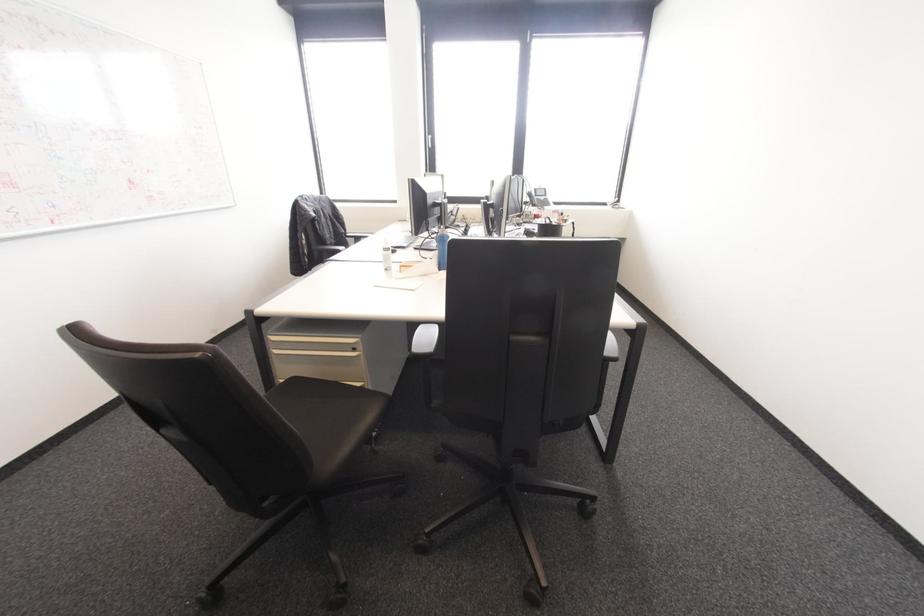
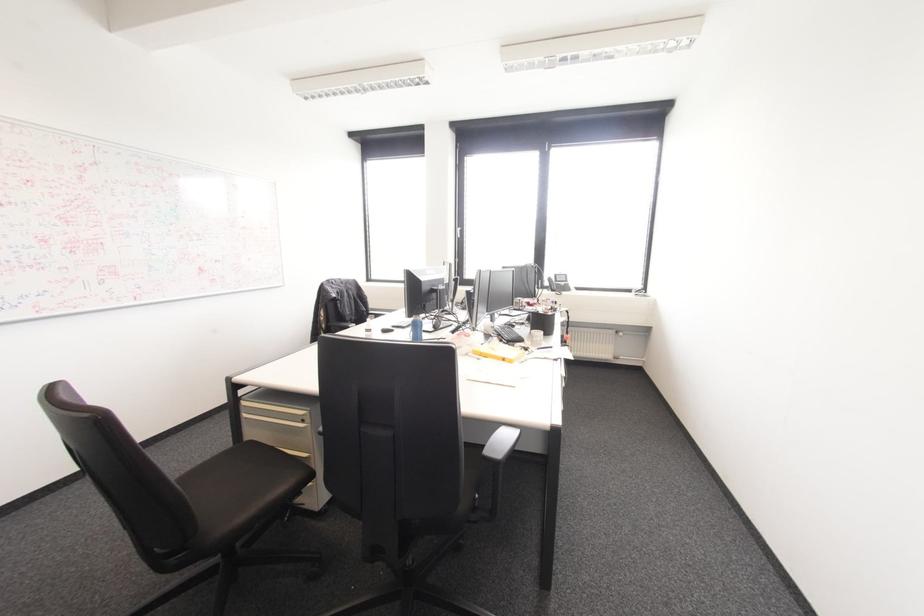
Question: The images are taken continuously from a first-person perspective. In which direction are you moving?

Choices:
 (A) Left
 (B) Right
 (C) Forward
 (D) Backward

Answer: (B)